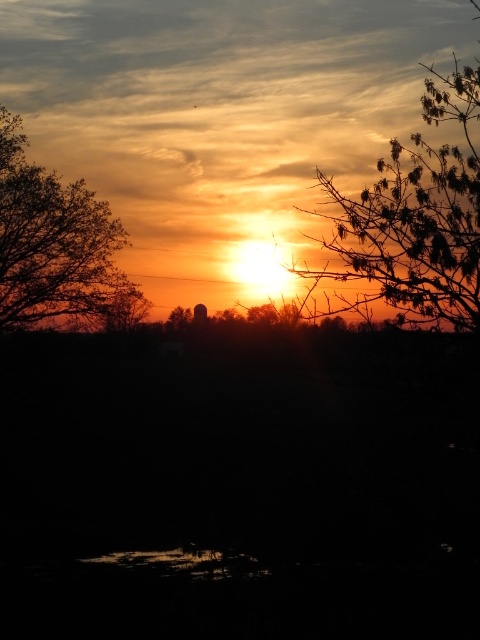
Question: Which object is farther from the camera taking this photo?

Choices:
 (A) silhouetted leafy tree at left
 (B) silhouetted leafy branch at upper right

Answer: (A)

Question: Which point is farther to the camera?

Choices:
 (A) click(84, 250)
 (B) click(381, 195)

Answer: (A)

Question: Is the position of silhouetted leafy branch at upper right less distant than that of silhouetted leafy tree at left?

Choices:
 (A) yes
 (B) no

Answer: (A)

Question: Does silhouetted leafy branch at upper right appear on the right side of silhouetted leafy tree at left?

Choices:
 (A) no
 (B) yes

Answer: (B)

Question: Which point is closer to the camera taking this photo?

Choices:
 (A) (406, 230)
 (B) (73, 248)

Answer: (A)

Question: Is silhouetted leafy branch at upper right to the right of silhouetted leafy tree at left from the viewer's perspective?

Choices:
 (A) yes
 (B) no

Answer: (A)